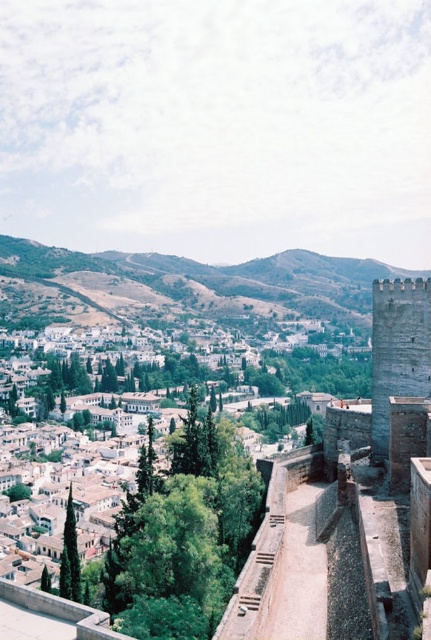
From the picture: Who is more forward, (x=3, y=260) or (x=402, y=356)?

Positioned in front is point (x=402, y=356).

Can you confirm if green grassy hillside at center is bigger than gray stone tower at right?

Yes.

Is point (202, 301) positioned in front of point (386, 403)?

No, it is behind (386, 403).

I want to click on green grassy hillside at center, so coord(194,284).

Which of these two, white stone town at center or green grassy hillside at center, stands shorter?

With less height is white stone town at center.

Who is more forward, (x=130, y=493) or (x=34, y=308)?

Point (x=130, y=493) is in front.

What are the coordinates of `white stone town at center` in the screenshot? It's located at (137, 492).

Is white stone town at center below gray stone tower at right?

Yes.

Identify the location of white stone town at center. (137, 492).

Is point (146, 426) behind point (384, 291)?

Yes.

Identify the location of white stone town at center. This screenshot has width=431, height=640. (137, 492).